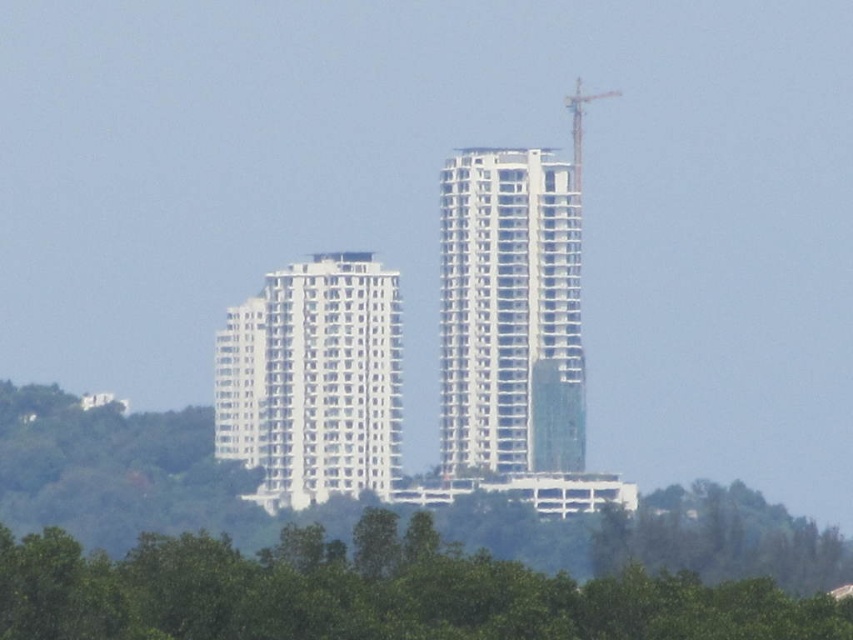
Between white concrete building at center and metallic gray crane at upper right, which one is positioned higher?

metallic gray crane at upper right is higher up.

Can you confirm if white concrete building at center is taller than metallic gray crane at upper right?

Indeed, white concrete building at center has a greater height compared to metallic gray crane at upper right.

Identify the location of white concrete building at center. (509, 314).

Does point (465, 364) lie behind point (299, 451)?

No, it is in front of (299, 451).

Who is more forward, (486, 392) or (347, 278)?

Point (347, 278)

Which is behind, point (544, 298) or point (263, 496)?

Positioned behind is point (263, 496).

Image resolution: width=853 pixels, height=640 pixels. In order to click on white concrete building at center in this screenshot , I will do `click(509, 314)`.

Is white smooth building at center shorter than metallic gray crane at upper right?

In fact, white smooth building at center may be taller than metallic gray crane at upper right.

Is white smooth building at center thinner than metallic gray crane at upper right?

No, white smooth building at center is not thinner than metallic gray crane at upper right.

Does point (364, 476) come farther from viewer compared to point (581, 92)?

No, (364, 476) is closer to viewer.

Where is `white smooth building at center`? white smooth building at center is located at coordinates (312, 380).